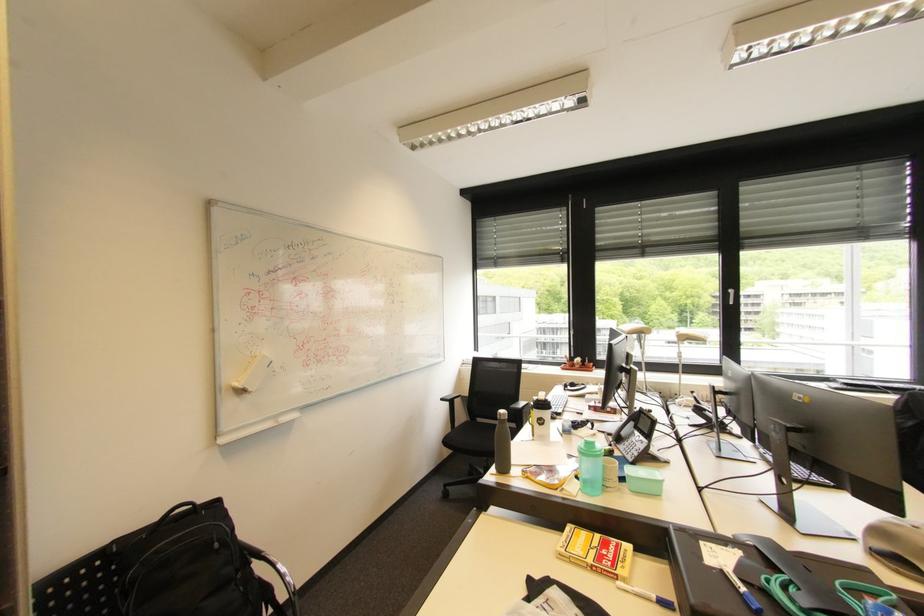
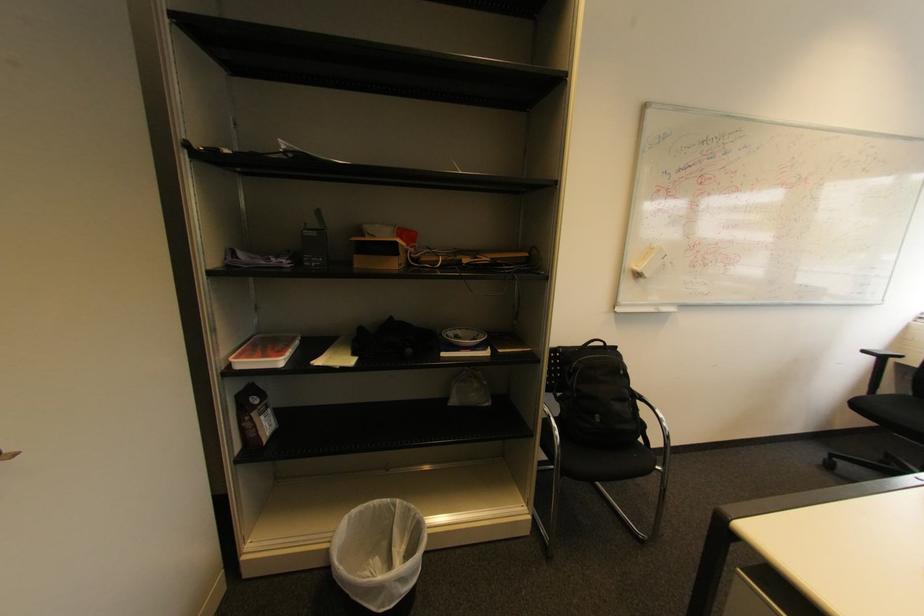
Where in the second image is the point corresponding to [247,392] from the first image?

(643, 276)